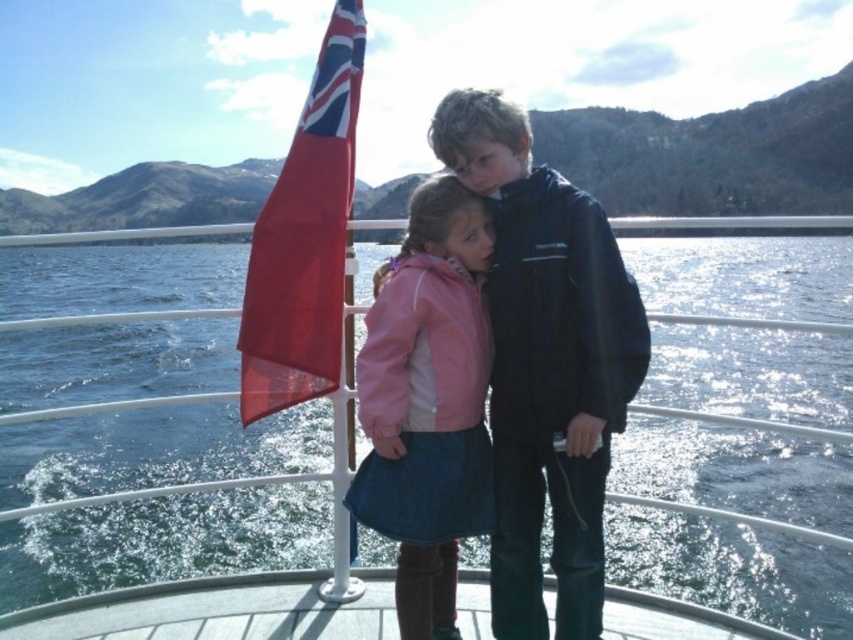
You are a photographer on the boat deck. You want to capture a photo of the glistening blue water at center and the red fabric flag at left. Which object should you focus on first if you want to include both in the same frame without changing your camera angle?

The red fabric flag at left should be focused on first because the glistening blue water at center is below it, so adjusting focus to the flag ensures both are in the frame.

You are a photographer trying to capture the glistening blue water at center and the red fabric flag at left in the same frame. Based on their positions, which object would appear closer to the top of your photo?

The glistening blue water at center appears closer to the top of the photo because it is taller than the red fabric flag at left.